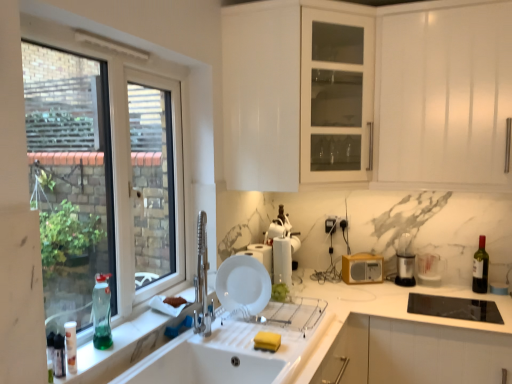
I want to click on vacant area that is situated to the right of white matte plate at sink, so click(284, 314).